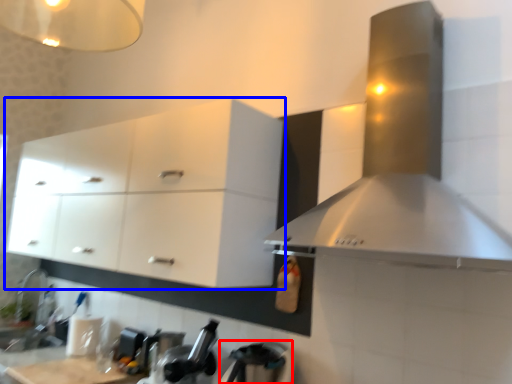
Question: Which of the following is the farthest to the observer, appliance (highlighted by a red box) or cabinetry (highlighted by a blue box)?

Choices:
 (A) appliance
 (B) cabinetry

Answer: (B)